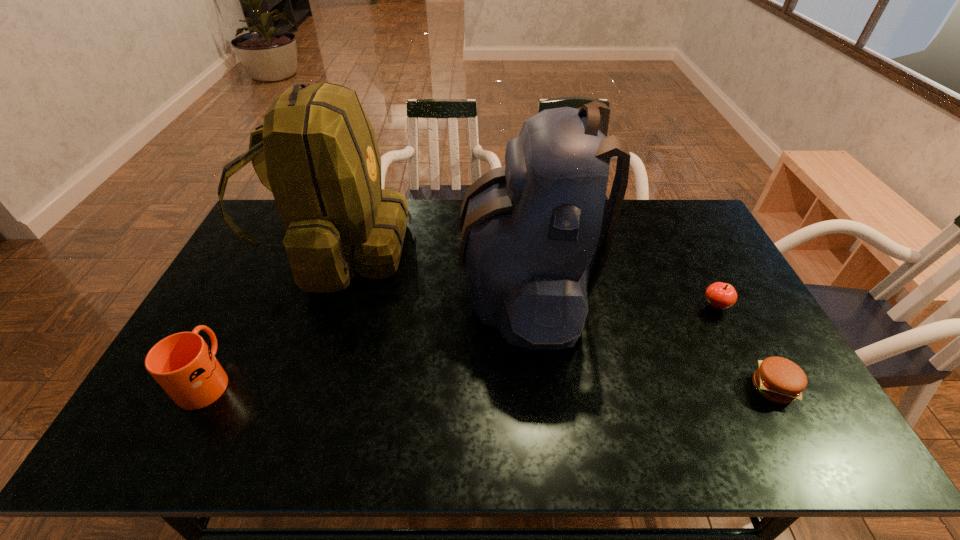
This screenshot has height=540, width=960. What are the coordinates of `free spot between the left backpack and the third shortest object` in the screenshot? It's located at (272, 314).

Identify the location of vacant space that's between the apple and the shortest object. (744, 347).

In order to click on vacant space that is in between the hamburger and the third shortest object in this screenshot , I will do `click(490, 383)`.

Identify which object is located as the second nearest to the hamburger. Please provide its 2D coordinates. Your answer should be formatted as a tuple, i.e. [(x, y)], where the tuple contains the x and y coordinates of a point satisfying the conditions above.

[(529, 229)]

Identify which object is the second closest to the fourth tallest object. Please provide its 2D coordinates. Your answer should be formatted as a tuple, i.e. [(x, y)], where the tuple contains the x and y coordinates of a point satisfying the conditions above.

[(529, 229)]

You are a GUI agent. You are given a task and a screenshot of the screen. Output one action in this format:
    pyautogui.click(x=<x>, y=<y>)
    Task: Click on the free point that satisfies the following two spatial constraints: 1. on the front-facing side of the shortest object; 2. on the right side of the left backpack
    The width and height of the screenshot is (960, 540).
    Given the screenshot: What is the action you would take?
    pyautogui.click(x=287, y=388)

Identify the location of vacant area in the image that satisfies the following two spatial constraints: 1. at the front pocket of the third object from right to left; 2. on the right side of the hamburger. (533, 388).

The height and width of the screenshot is (540, 960). What are the coordinates of `vacant region that satisfies the following two spatial constraints: 1. on the front-facing side of the left backpack; 2. on the back side of the shortest object` in the screenshot? It's located at (287, 388).

This screenshot has width=960, height=540. I want to click on free space in the image that satisfies the following two spatial constraints: 1. at the front pocket of the third object from left to right; 2. on the back side of the shortest object, so click(x=533, y=388).